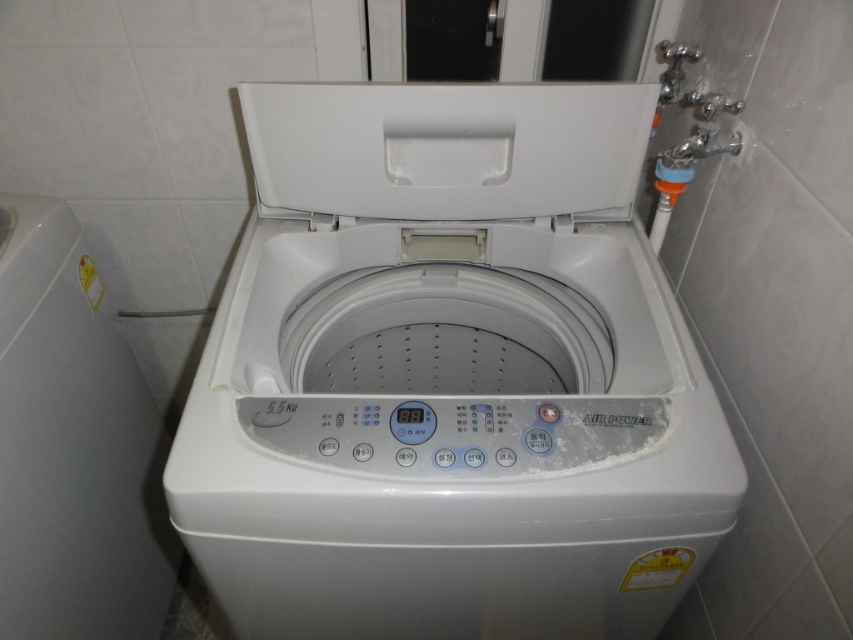
You are moving a white plastic washing machine at lower left and a white matte lid at center into a storage room with a height restriction of 1.5 meters. If the washing machine is 1.6 meters tall, will both items fit inside the storage room?

The white plastic washing machine at lower left has a greater height compared to the white matte lid at center. Since the washing machine is 1.6 meters tall and the storage room has a 1.5 meters height restriction, the washing machine will not fit. The lid might fit, but since the question asks about both items, they cannot both fit inside the storage room.

You are a repair technician who needs to access the control panel of the white plastic washing machine at center. The white matte lid at center is currently open. Can you reach the control panel without moving the lid?

The distance between the white plastic washing machine at center and the white matte lid at center is 18.07 centimeters. Since the lid is open, you can reach the control panel without moving it.

You are standing in front of a white plastic washing machine at lower left and want to reach a detergent bottle placed on a shelf 1 meter away from you. Can you determine if you can reach the detergent bottle without moving your position?

The white plastic washing machine at lower left is 74.21 centimeters away from camera, so you can reach the detergent bottle placed 1 meter away from you without moving your position since 1 meter is farther than 74.21 centimeters.